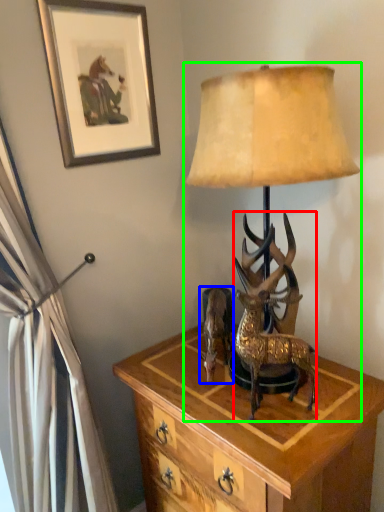
Question: Based on their relative distances, which object is nearer to deer (highlighted by a red box)? Choose from reindeer (highlighted by a blue box) and lamp (highlighted by a green box).

Choices:
 (A) reindeer
 (B) lamp

Answer: (A)